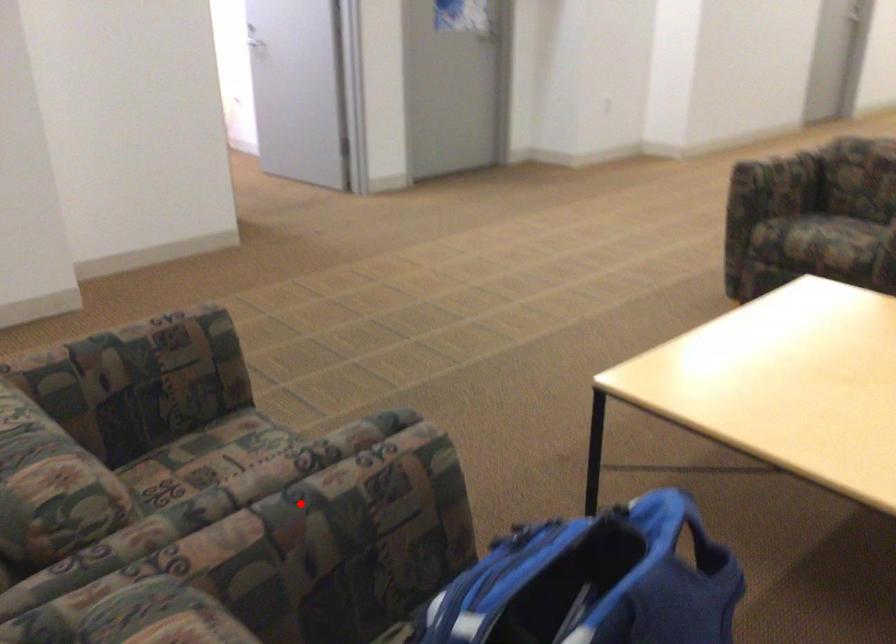
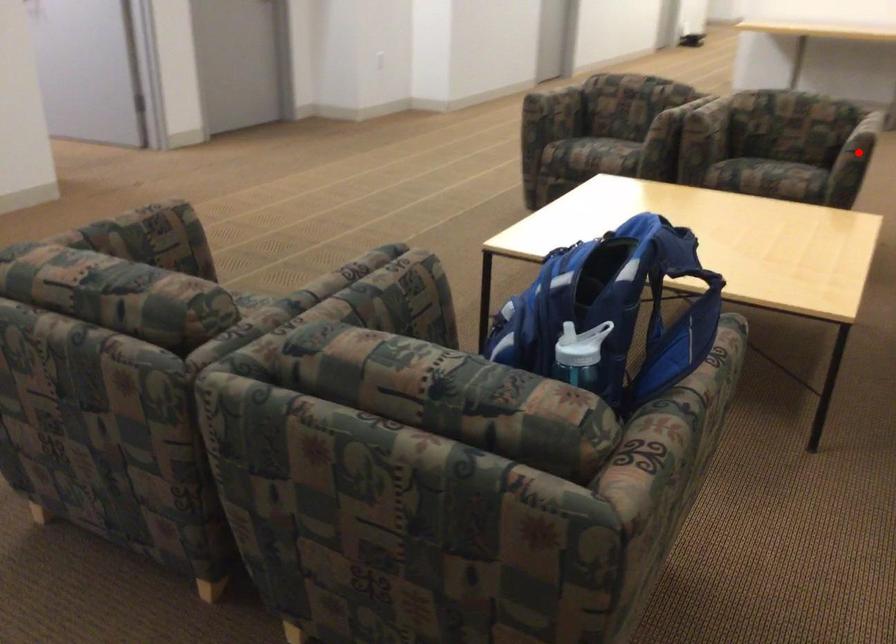
Looking at this image, I am providing you with two images of the same scene from different viewpoints. A red point is marked on the first image and another point is marked on the second image. Is the red point in image1 aligned with the point shown in image2?

No